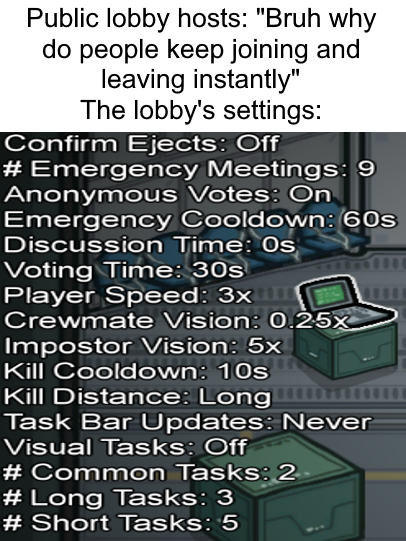
Where is `walls`? This screenshot has width=406, height=541. walls is located at coordinates (38, 334), (316, 144), (377, 148).